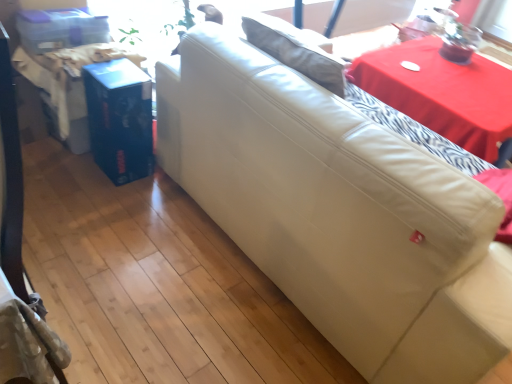
Question: Can you confirm if leather couch at center is shorter than red fabric table at upper right?

Choices:
 (A) yes
 (B) no

Answer: (B)

Question: Is leather couch at center touching red fabric table at upper right?

Choices:
 (A) no
 (B) yes

Answer: (A)

Question: Is leather couch at center positioned with its back to red fabric table at upper right?

Choices:
 (A) yes
 (B) no

Answer: (B)

Question: Does leather couch at center have a larger size compared to red fabric table at upper right?

Choices:
 (A) no
 (B) yes

Answer: (B)

Question: Considering the relative sizes of leather couch at center and red fabric table at upper right in the image provided, is leather couch at center wider than red fabric table at upper right?

Choices:
 (A) no
 (B) yes

Answer: (B)

Question: Is leather couch at center smaller than red fabric table at upper right?

Choices:
 (A) yes
 (B) no

Answer: (B)

Question: Is there a large distance between red fabric table at upper right and leather couch at center?

Choices:
 (A) no
 (B) yes

Answer: (B)

Question: Is red fabric table at upper right at the left side of leather couch at center?

Choices:
 (A) no
 (B) yes

Answer: (A)

Question: Is red fabric table at upper right next to leather couch at center and touching it?

Choices:
 (A) yes
 (B) no

Answer: (B)

Question: From the image's perspective, is red fabric table at upper right located beneath leather couch at center?

Choices:
 (A) no
 (B) yes

Answer: (A)

Question: Is red fabric table at upper right outside leather couch at center?

Choices:
 (A) no
 (B) yes

Answer: (B)

Question: Is the depth of red fabric table at upper right less than that of leather couch at center?

Choices:
 (A) no
 (B) yes

Answer: (A)

Question: From their relative heights in the image, would you say red fabric table at upper right is taller or shorter than leather couch at center?

Choices:
 (A) short
 (B) tall

Answer: (A)